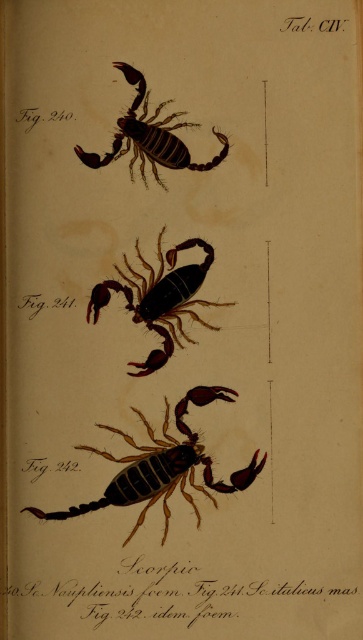
You are examining a page from a scientific book about scorpions. There are two points marked on the page at coordinates point (210,476) and point (148,156). If you were to touch both points with your finger, which one would feel closer to your hand?

Point (210,476) is closer to the viewer than point (148,156), so touching point (210,476) would feel closer to your hand.

You are a researcher examining the scorpion illustrations in the book. You need to place a ruler between the shiny brown scorpion at center and the brown matte scorpion at upper center. How far apart are these two scorpions?

The shiny brown scorpion at center is 6.82 inches from the brown matte scorpion at upper center, so the ruler should be placed to measure that distance between them.

You are a researcher studying scorpion illustrations in a book. You notice two scorpions labeled as shiny brown scorpion at center and brown matte scorpion at upper center. Which one is positioned to the right of the other?

The shiny brown scorpion at center is positioned to the right of the brown matte scorpion at upper center.